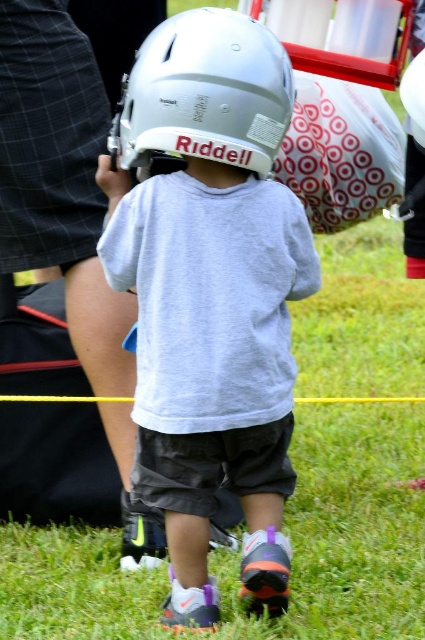
You are a sports equipment inspector checking the helmets in the image. The image shows a matte gray helmet at center and a white matte football helmet at center. According to the manufacturer specifications, the maximum allowable width for helmets is 12 inches. Can you determine if both helmets meet the width requirement?

The matte gray helmet at center might be wider than white matte football helmet at center. However, without exact measurements, it is uncertain if both helmets meet the 12 inch width requirement. Further measurement is needed.

You are a referee at a football field and see the matte gray helmet at center and the white matte football helmet at center. Which helmet is positioned lower in the image?

The matte gray helmet at center is positioned below the white matte football helmet at center, so it is lower in the image.